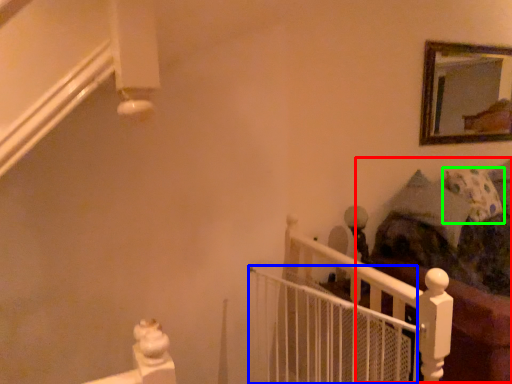
Question: Which object is positioned closest to bed (highlighted by a red box)? Select from balustrade (highlighted by a blue box) and pillow (highlighted by a green box).

Choices:
 (A) balustrade
 (B) pillow

Answer: (B)